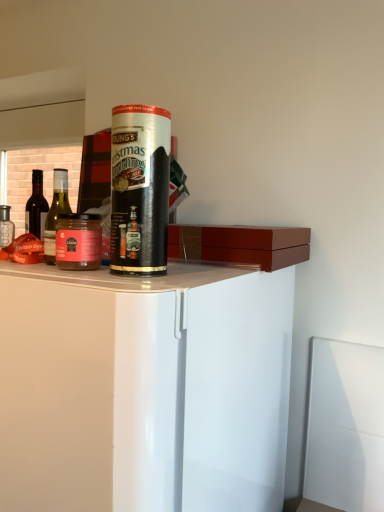
You are a GUI agent. You are given a task and a screenshot of the screen. Output one action in this format:
    pyautogui.click(x=<x>, y=<y>)
    Task: Click on the vacant space in front of transparent plastic straw at center
    The width and height of the screenshot is (384, 512).
    Given the screenshot: What is the action you would take?
    pyautogui.click(x=130, y=281)